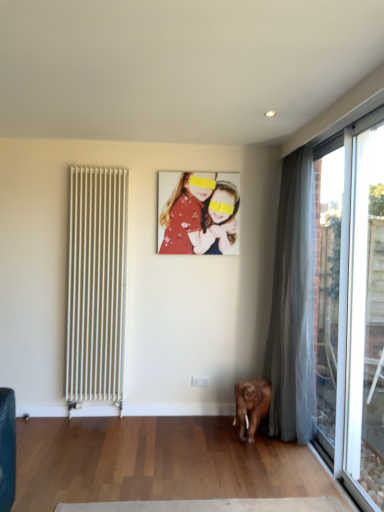
Where is `free point above matte floral dress at center (from a real-world perspective)`? The height and width of the screenshot is (512, 384). free point above matte floral dress at center (from a real-world perspective) is located at coordinates (197, 170).